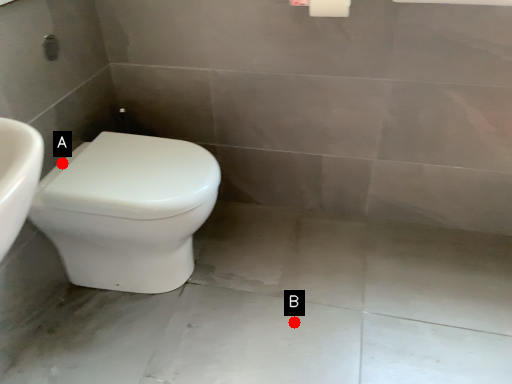
Question: Two points are circled on the image, labeled by A and B beside each circle. Which point is closer to the camera?

Choices:
 (A) A is closer
 (B) B is closer

Answer: (A)